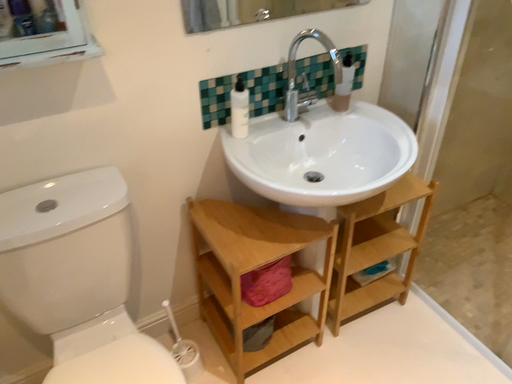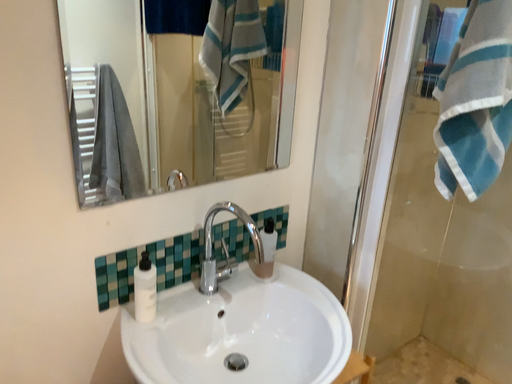
Question: Which way did the camera rotate in the video?

Choices:
 (A) rotated downward
 (B) rotated upward

Answer: (B)